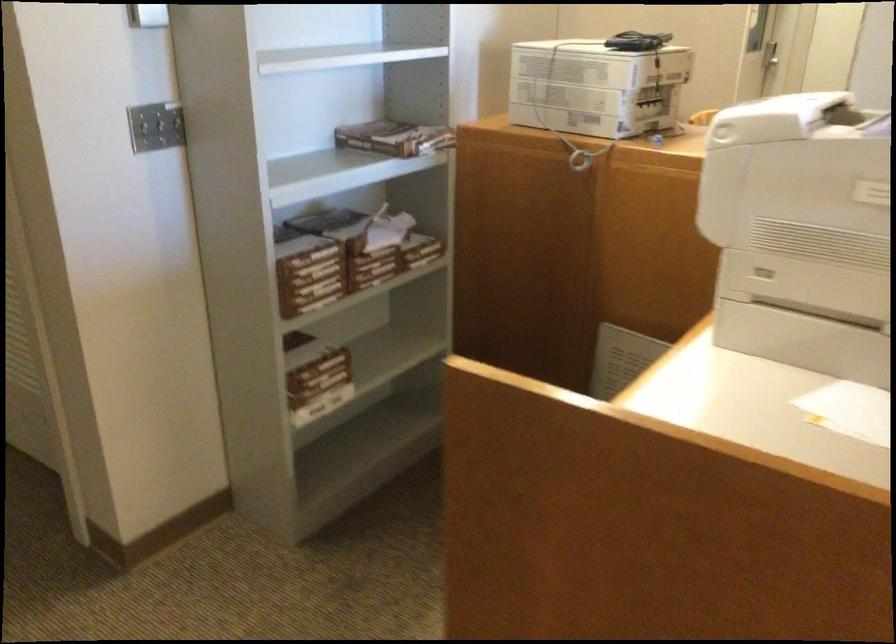
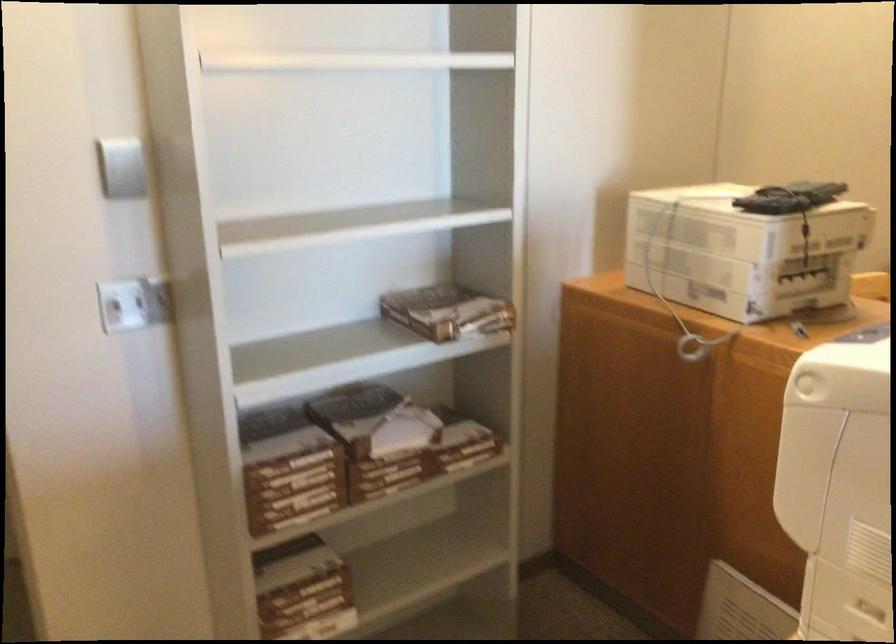
Question: Based on the continuous images, in which direction is the camera rotating? Reply with the corresponding letter.

Choices:
 (A) Left
 (B) Right
 (C) Up
 (D) Down

Answer: (A)